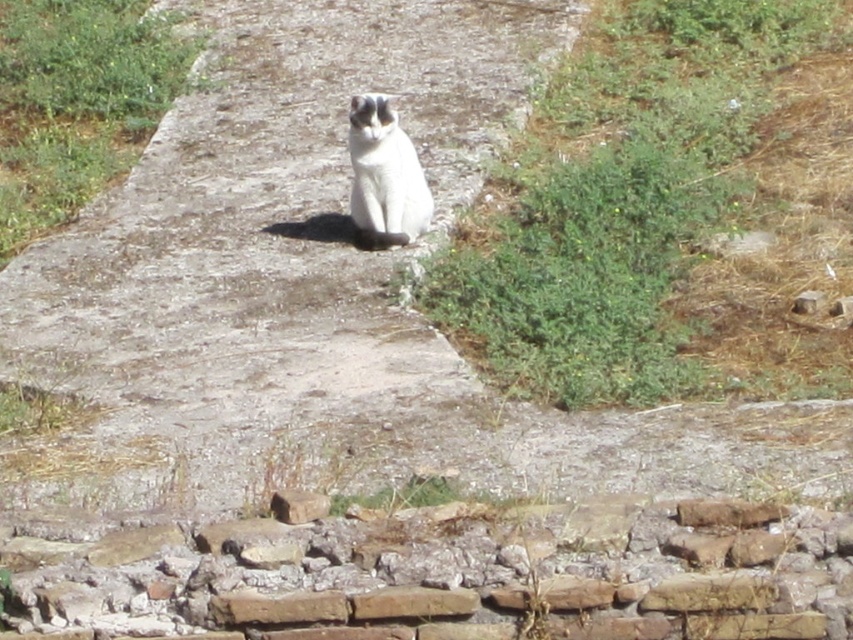
In the scene shown: Can you confirm if rusty brick wall at lower center is shorter than white fur cat at center?

Yes.

Is point (663, 513) closer to viewer compared to point (369, 120)?

Yes, it is.

Describe the element at coordinates (451, 577) in the screenshot. The image size is (853, 640). I see `rusty brick wall at lower center` at that location.

Find the location of `rusty brick wall at lower center`. rusty brick wall at lower center is located at coordinates (451, 577).